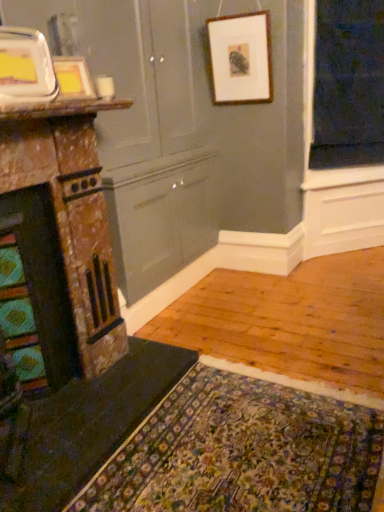
Question: In terms of width, does marble fireplace at left look wider or thinner when compared to wooden picture frame at upper center, the 3th picture frame positioned from the front?

Choices:
 (A) wide
 (B) thin

Answer: (A)

Question: In terms of height, does marble fireplace at left look taller or shorter compared to wooden picture frame at upper center, which is the third picture frame in left-to-right order?

Choices:
 (A) short
 (B) tall

Answer: (B)

Question: Which object is positioned farthest from the wooden picture frame at upper center, which is the 3th picture frame in bottom-to-top order?

Choices:
 (A) dark green felt doormat at lower left
 (B) white marble countertop at upper left
 (C) black fabric at upper right
 (D) matte white picture frame at upper left, which is the first picture frame from left to right
 (E) wooden picture frame at upper left, arranged as the 2th picture frame when ordered from the bottom

Answer: (A)

Question: Which object is the closest to the wooden picture frame at upper center, which is the 3th picture frame in bottom-to-top order?

Choices:
 (A) dark green felt doormat at lower left
 (B) wooden picture frame at upper left, the second picture frame viewed from the front
 (C) white marble countertop at upper left
 (D) black fabric at upper right
 (E) marble fireplace at left

Answer: (D)